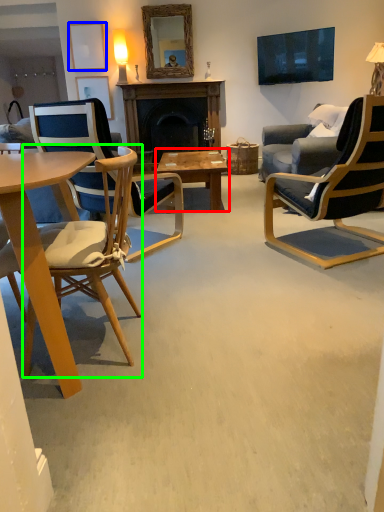
Question: Based on their relative distances, which object is farther from coffee table (highlighted by a red box)? Choose from picture frame (highlighted by a blue box) and chair (highlighted by a green box).

Choices:
 (A) picture frame
 (B) chair

Answer: (A)